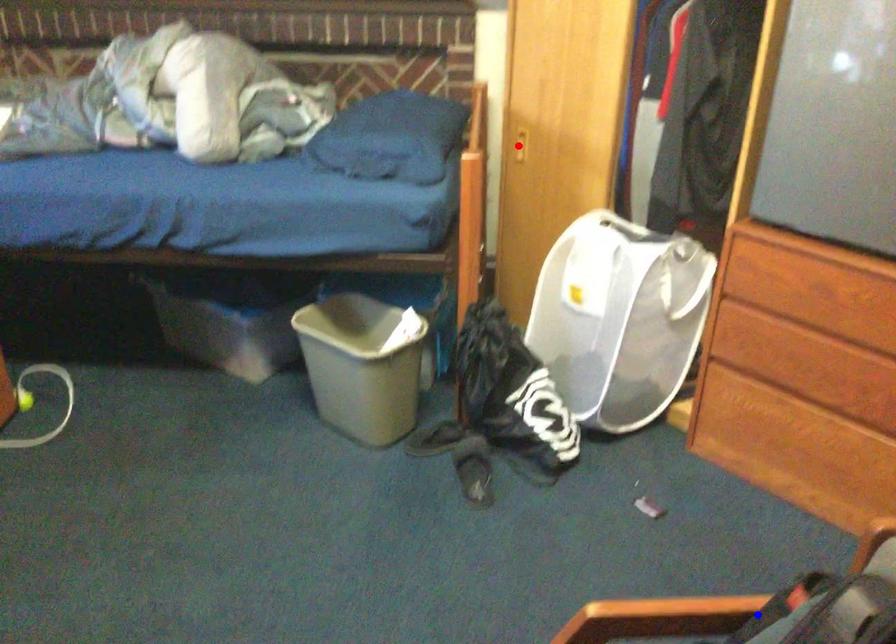
Question: Which of the two points in the image is closer to the camera?

Choices:
 (A) Blue point is closer.
 (B) Red point is closer.

Answer: (A)